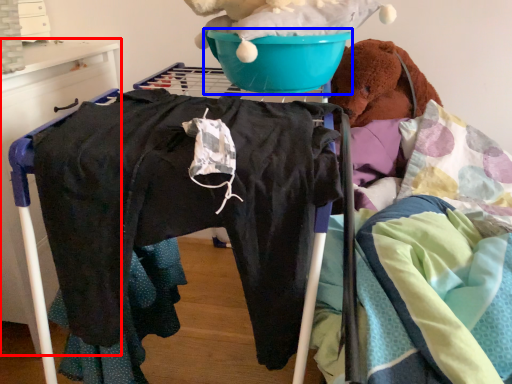
Question: Among these objects, which one is nearest to the camera, furniture (highlighted by a red box) or basin (highlighted by a blue box)?

Choices:
 (A) furniture
 (B) basin

Answer: (B)